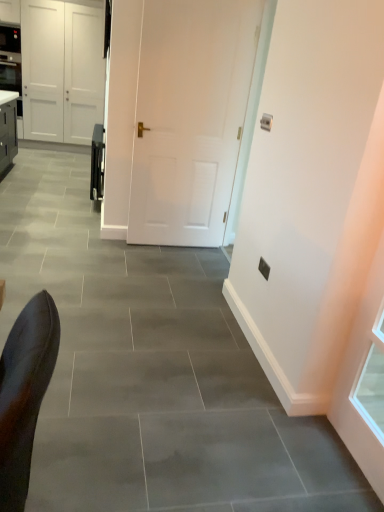
Question: Is satin black oven at center in front of white matte door at center, which ranks as the 1th door in bottom-to-top order?

Choices:
 (A) yes
 (B) no

Answer: (B)

Question: Is satin black oven at center to the left of white matte door at center, the 1th door positioned from the front, from the viewer's perspective?

Choices:
 (A) yes
 (B) no

Answer: (A)

Question: From a real-world perspective, is satin black oven at center under white matte door at center, positioned as the 1th door in right-to-left order?

Choices:
 (A) yes
 (B) no

Answer: (A)

Question: From a real-world perspective, does satin black oven at center stand above white matte door at center, the 1th door positioned from the front?

Choices:
 (A) yes
 (B) no

Answer: (B)

Question: Considering the relative positions of satin black oven at center and white matte door at center, placed as the second door when sorted from back to front, in the image provided, is satin black oven at center to the right of white matte door at center, placed as the second door when sorted from back to front, from the viewer's perspective?

Choices:
 (A) no
 (B) yes

Answer: (A)

Question: Does satin black oven at center have a lesser height compared to white matte door at center, positioned as the 1th door in right-to-left order?

Choices:
 (A) no
 (B) yes

Answer: (B)

Question: Is white matte door at center, the second door in the bottom-to-top sequence, thinner than satin black oven at center?

Choices:
 (A) no
 (B) yes

Answer: (A)

Question: Considering the relative sizes of white matte door at center, positioned as the 2th door in right-to-left order, and satin black oven at center in the image provided, is white matte door at center, positioned as the 2th door in right-to-left order, taller than satin black oven at center?

Choices:
 (A) no
 (B) yes

Answer: (B)

Question: Is satin black oven at center completely or partially inside white matte door at center, the second door in the bottom-to-top sequence?

Choices:
 (A) yes
 (B) no

Answer: (B)

Question: From a real-world perspective, is white matte door at center, the 2th door in the front-to-back sequence, over satin black oven at center?

Choices:
 (A) no
 (B) yes

Answer: (B)

Question: Is white matte door at center, the 1th door in the back-to-front sequence, facing away from satin black oven at center?

Choices:
 (A) no
 (B) yes

Answer: (A)

Question: Does white matte door at center, which ranks as the first door in top-to-bottom order, have a lesser height compared to satin black oven at center?

Choices:
 (A) yes
 (B) no

Answer: (B)

Question: Is white matte door at center, which is counted as the first door, starting from the left, at the right side of white matte door at center, the 1th door positioned from the front?

Choices:
 (A) yes
 (B) no

Answer: (B)